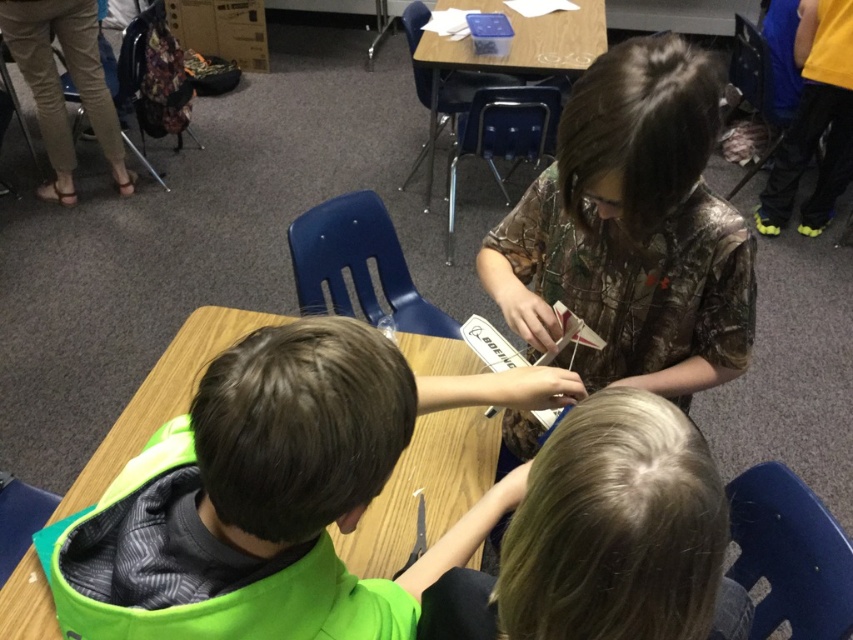
Question: Can you confirm if camouflage shirt at center is positioned to the left of blonde hair at center?

Choices:
 (A) no
 (B) yes

Answer: (A)

Question: Among these objects, which one is nearest to the camera?

Choices:
 (A) blonde hair at center
 (B) green fabric shirt at center

Answer: (A)

Question: Which object is closer to the camera taking this photo?

Choices:
 (A) green fabric shirt at center
 (B) blonde hair at center
 (C) camouflage shirt at center

Answer: (B)

Question: Is green fabric shirt at center further to camera compared to blonde hair at center?

Choices:
 (A) no
 (B) yes

Answer: (B)

Question: Is green fabric shirt at center thinner than camouflage shirt at center?

Choices:
 (A) no
 (B) yes

Answer: (A)

Question: Which object appears closest to the camera in this image?

Choices:
 (A) green fabric shirt at center
 (B) blonde hair at center

Answer: (B)